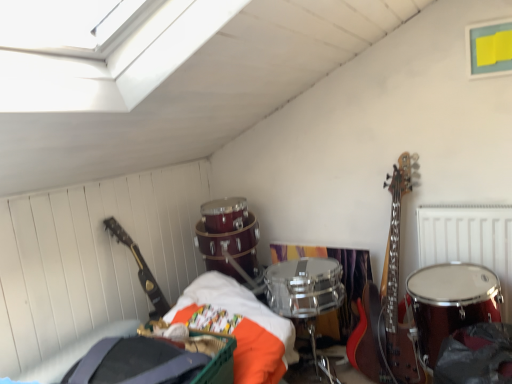
Question: Should I look upward or downward to see glossy black guitar at left?

Choices:
 (A) down
 (B) up

Answer: (A)

Question: Can you confirm if glossy black guitar at left is smaller than shiny red drum at right?

Choices:
 (A) yes
 (B) no

Answer: (A)

Question: Is glossy black guitar at left further to the viewer compared to shiny red drum at right?

Choices:
 (A) yes
 (B) no

Answer: (A)

Question: Considering the relative positions of glossy black guitar at left and shiny red drum at right in the image provided, is glossy black guitar at left to the right of shiny red drum at right from the viewer's perspective?

Choices:
 (A) no
 (B) yes

Answer: (A)

Question: From the image's perspective, is glossy black guitar at left below shiny red drum at right?

Choices:
 (A) no
 (B) yes

Answer: (A)

Question: From the image's perspective, is glossy black guitar at left located above shiny red drum at right?

Choices:
 (A) no
 (B) yes

Answer: (B)

Question: Does glossy black guitar at left turn towards shiny red drum at right?

Choices:
 (A) no
 (B) yes

Answer: (A)

Question: From the image's perspective, would you say metallic silver radiator at upper right is shown under shiny red drum at right?

Choices:
 (A) no
 (B) yes

Answer: (A)

Question: Is shiny red drum at right completely or partially inside metallic silver radiator at upper right?

Choices:
 (A) no
 (B) yes

Answer: (A)

Question: Are metallic silver radiator at upper right and shiny red drum at right located far from each other?

Choices:
 (A) yes
 (B) no

Answer: (B)

Question: Considering the relative positions of metallic silver radiator at upper right and shiny red drum at right in the image provided, is metallic silver radiator at upper right in front of shiny red drum at right?

Choices:
 (A) yes
 (B) no

Answer: (B)

Question: Can you confirm if metallic silver radiator at upper right is thinner than shiny red drum at right?

Choices:
 (A) no
 (B) yes

Answer: (B)

Question: Is metallic silver radiator at upper right to the right of shiny red drum at right from the viewer's perspective?

Choices:
 (A) yes
 (B) no

Answer: (A)

Question: Can you confirm if glossy black guitar at left is smaller than metallic silver radiator at upper right?

Choices:
 (A) no
 (B) yes

Answer: (B)